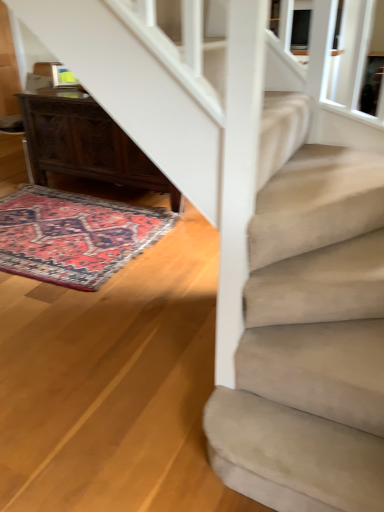
Question: Considering the positions of dark wood desk at lower left and carpeted rug at lower left in the image, is dark wood desk at lower left wider or thinner than carpeted rug at lower left?

Choices:
 (A) thin
 (B) wide

Answer: (A)

Question: Based on their positions, is dark wood desk at lower left located to the left or right of carpeted rug at lower left?

Choices:
 (A) left
 (B) right

Answer: (B)

Question: From a real-world perspective, is dark wood desk at lower left physically located above or below carpeted rug at lower left?

Choices:
 (A) above
 (B) below

Answer: (A)

Question: Based on their positions, is carpeted rug at lower left located to the left or right of dark wood desk at lower left?

Choices:
 (A) left
 (B) right

Answer: (A)

Question: Looking at their shapes, would you say carpeted rug at lower left is wider or thinner than dark wood desk at lower left?

Choices:
 (A) wide
 (B) thin

Answer: (A)

Question: Based on their sizes in the image, would you say carpeted rug at lower left is bigger or smaller than dark wood desk at lower left?

Choices:
 (A) small
 (B) big

Answer: (A)

Question: From a real-world perspective, relative to dark wood desk at lower left, is carpeted rug at lower left vertically above or below?

Choices:
 (A) above
 (B) below

Answer: (B)